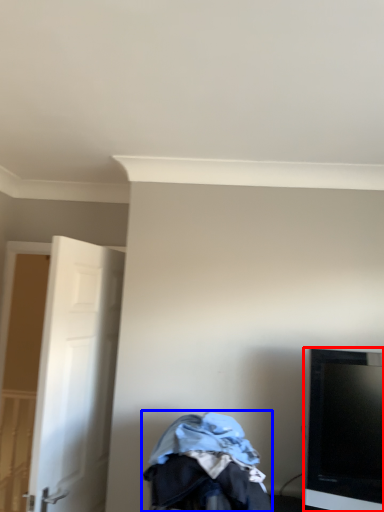
Question: Which object is closer to the camera taking this photo, television (highlighted by a red box) or baby carriage (highlighted by a blue box)?

Choices:
 (A) television
 (B) baby carriage

Answer: (B)